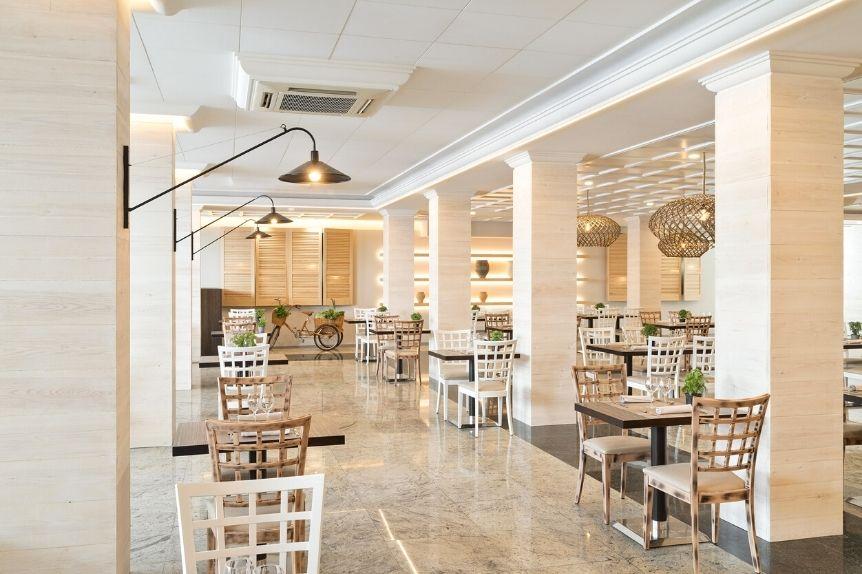
The width and height of the screenshot is (862, 574). In order to click on small plants in this screenshot , I will do `click(242, 339)`, `click(279, 313)`, `click(330, 315)`, `click(380, 309)`, `click(420, 315)`, `click(706, 382)`, `click(848, 324)`, `click(675, 311)`, `click(641, 325)`, `click(592, 300)`.